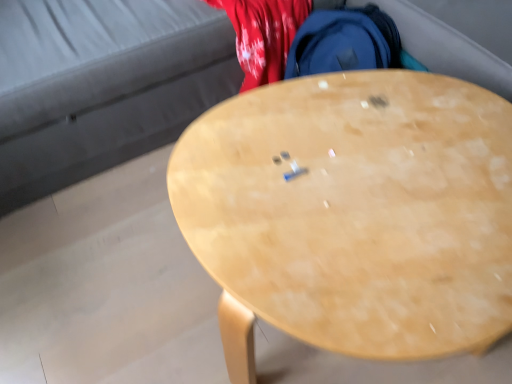
What do you see at coordinates (354, 214) in the screenshot?
I see `light wood desk at center` at bounding box center [354, 214].

Where is `light wood desk at center`? This screenshot has width=512, height=384. light wood desk at center is located at coordinates (354, 214).

The image size is (512, 384). Describe the element at coordinates (102, 86) in the screenshot. I see `velvet grey couch at upper center` at that location.

Where is `velvet grey couch at upper center`? velvet grey couch at upper center is located at coordinates (102, 86).

The width and height of the screenshot is (512, 384). I want to click on light wood desk at center, so click(x=354, y=214).

Considering the positions of objects velvet grey couch at upper center and light wood desk at center in the image provided, who is more to the right, velvet grey couch at upper center or light wood desk at center?

light wood desk at center is more to the right.

Is velvet grey couch at upper center in front of or behind light wood desk at center in the image?

velvet grey couch at upper center is behind light wood desk at center.

Is point (80, 141) positioned in front of point (468, 300)?

No, (80, 141) is behind (468, 300).

From the image's perspective, is velvet grey couch at upper center located beneath light wood desk at center?

No, from the image's perspective, velvet grey couch at upper center is not below light wood desk at center.

From a real-world perspective, is velvet grey couch at upper center beneath light wood desk at center?

No.

Which object is wider, velvet grey couch at upper center or light wood desk at center?

Wider between the two is velvet grey couch at upper center.

Considering the sizes of velvet grey couch at upper center and light wood desk at center in the image, is velvet grey couch at upper center taller or shorter than light wood desk at center?

In the image, velvet grey couch at upper center appears to be taller than light wood desk at center.

Which of these two, velvet grey couch at upper center or light wood desk at center, is bigger?

With larger size is velvet grey couch at upper center.

Could light wood desk at center be considered to be inside velvet grey couch at upper center?

No, light wood desk at center is located outside of velvet grey couch at upper center.

Is there a large distance between velvet grey couch at upper center and light wood desk at center?

No.

Is velvet grey couch at upper center looking in the opposite direction of light wood desk at center?

velvet grey couch at upper center does not have its back to light wood desk at center.

Can you tell me how much velvet grey couch at upper center and light wood desk at center differ in facing direction?

The angle between the facing direction of velvet grey couch at upper center and the facing direction of light wood desk at center is 0.0115 degrees.

Identify the location of desk below the velvet grey couch at upper center (from the image's perspective). (354, 214).

Considering the positions of objects light wood desk at center and velvet grey couch at upper center in the image provided, who is more to the right, light wood desk at center or velvet grey couch at upper center?

light wood desk at center is more to the right.

Does light wood desk at center lie in front of velvet grey couch at upper center?

Yes, it is.

Is point (379, 309) closer or farther from the camera than point (166, 22)?

Point (379, 309) is closer to the camera than point (166, 22).

From the image's perspective, is light wood desk at center above velvet grey couch at upper center?

No, from the image's perspective, light wood desk at center is not over velvet grey couch at upper center.

From a real-world perspective, is light wood desk at center located higher than velvet grey couch at upper center?

Actually, light wood desk at center is physically below velvet grey couch at upper center in the real world.

Which object is wider, light wood desk at center or velvet grey couch at upper center?

velvet grey couch at upper center is wider.

Considering the sizes of objects light wood desk at center and velvet grey couch at upper center in the image provided, who is shorter, light wood desk at center or velvet grey couch at upper center?

light wood desk at center.

Considering the relative sizes of light wood desk at center and velvet grey couch at upper center in the image provided, is light wood desk at center smaller than velvet grey couch at upper center?

Yes.

Would you say light wood desk at center is inside or outside velvet grey couch at upper center?

light wood desk at center is not enclosed by velvet grey couch at upper center.

Is the surface of light wood desk at center in direct contact with velvet grey couch at upper center?

No, light wood desk at center is not making contact with velvet grey couch at upper center.

Could you tell me if light wood desk at center is facing velvet grey couch at upper center?

No, light wood desk at center is not oriented towards velvet grey couch at upper center.

What's the angular difference between light wood desk at center and velvet grey couch at upper center's facing directions?

0.0115 degrees.

I want to click on desk in front of the velvet grey couch at upper center, so click(x=354, y=214).

Find the location of a particular element. The height and width of the screenshot is (384, 512). studio couch behind the light wood desk at center is located at coordinates (102, 86).

In the image, there is a light wood desk at center. Identify the location of studio couch above it (from the image's perspective). [x=102, y=86].